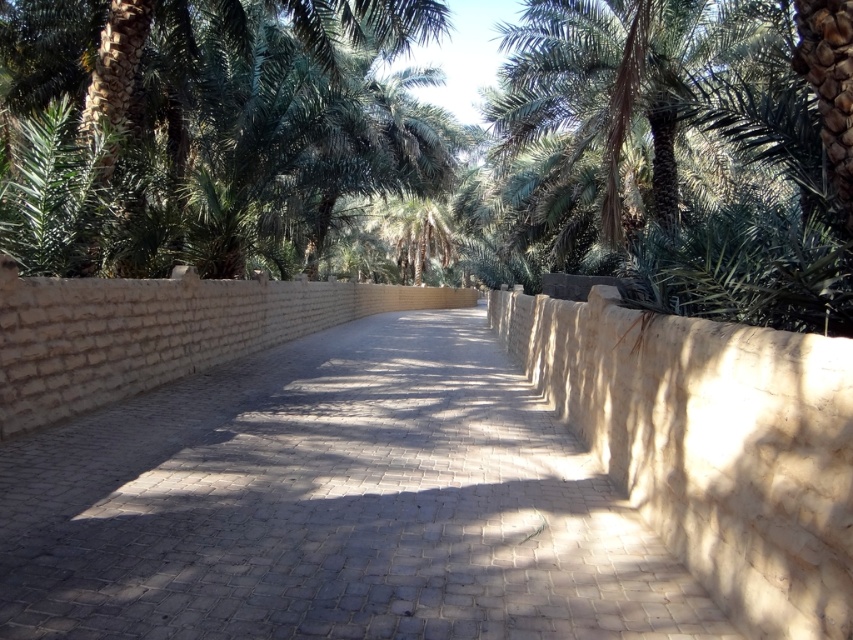
You are a gardener planning to install a new sprinkler system along the pathway. The sprinkler requires a 1.2 meter clearance from any obstacles. Based on the scene, can the sprinkler be placed along the light beige cobblestone pavement at center without interfering with the green leafy palm tree at upper center?

The light beige cobblestone pavement at center might be wider than the green leafy palm tree at upper center, so there might be enough space for the sprinkler system with the required 1.2 meter clearance.

You are a maintenance worker who needs to place a 7 feet long wooden plank across the light beige cobblestone pavement at center. Can you fit it without overlapping the edges?

The light beige cobblestone pavement at center is 6.95 feet in length. Since the wooden plank is 7 feet long, it will not fit without overlapping the edges.

You are walking along the pathway and want to take a photo of both the green leafy palm tree at center and the green leafy palm tree at upper center. Which tree should you focus on first to ensure both are in clear view?

You should focus on the green leafy palm tree at upper center first because it is farther away than the green leafy palm tree at center, so adjusting focus from far to near can help capture both clearly.